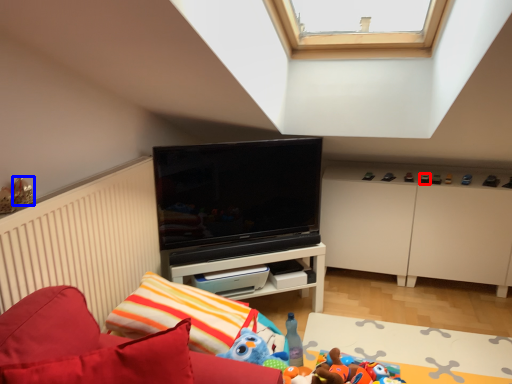
Question: Which point is further to the camera, toy (highlighted by a red box) or toy (highlighted by a blue box)?

Choices:
 (A) toy
 (B) toy

Answer: (A)